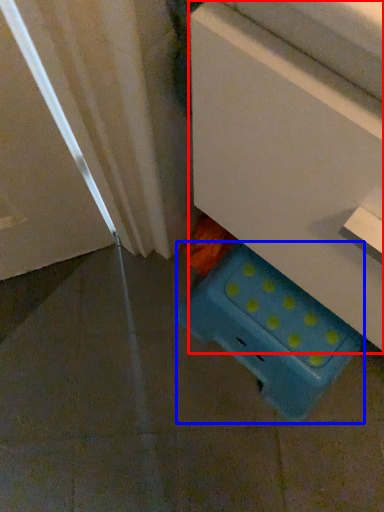
Question: Among these objects, which one is nearest to the camera, furniture (highlighted by a red box) or storage box (highlighted by a blue box)?

Choices:
 (A) furniture
 (B) storage box

Answer: (A)